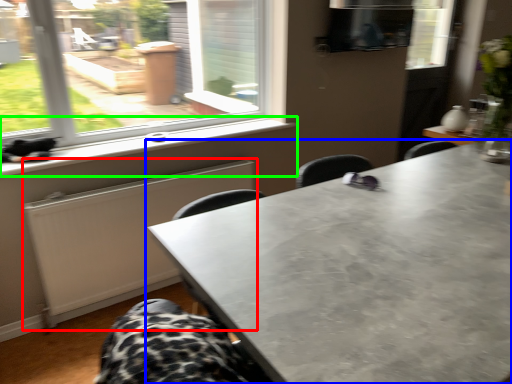
Question: Based on their relative distances, which object is nearer to radiator (highlighted by a red box)? Choose from table (highlighted by a blue box) and window sill (highlighted by a green box).

Choices:
 (A) table
 (B) window sill

Answer: (B)